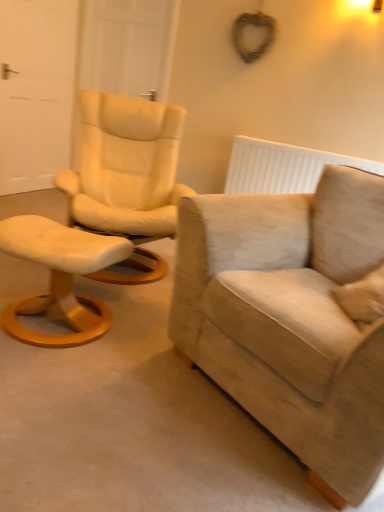
Question: Does beige fabric armchair at right contain white wood door at upper left, which appears as the 2th door when viewed from the left?

Choices:
 (A) no
 (B) yes

Answer: (A)

Question: Is the depth of beige fabric armchair at right greater than that of white wood door at upper left, which appears as the 2th door when viewed from the left?

Choices:
 (A) yes
 (B) no

Answer: (B)

Question: Could you tell me if beige fabric armchair at right is facing white wood door at upper left, which appears as the 2th door when viewed from the left?

Choices:
 (A) no
 (B) yes

Answer: (A)

Question: Is beige fabric armchair at right completely or partially outside of white wood door at upper left, which appears as the 2th door when viewed from the left?

Choices:
 (A) no
 (B) yes

Answer: (B)

Question: From the image's perspective, would you say beige fabric armchair at right is positioned over white wood door at upper left, which appears as the 2th door when viewed from the left?

Choices:
 (A) yes
 (B) no

Answer: (B)

Question: Is white fabric stool at left bigger or smaller than beige fabric armchair at right?

Choices:
 (A) big
 (B) small

Answer: (B)

Question: Is point (48, 221) positioned closer to the camera than point (319, 242)?

Choices:
 (A) closer
 (B) farther

Answer: (A)

Question: From the image's perspective, is white fabric stool at left positioned above or below beige fabric armchair at right?

Choices:
 (A) below
 (B) above

Answer: (B)

Question: From a real-world perspective, is white fabric stool at left physically located above or below beige fabric armchair at right?

Choices:
 (A) above
 (B) below

Answer: (B)

Question: Relative to white textured radiator at upper right, is white matte door at left, marked as the 2th door in a right-to-left arrangement, in front or behind?

Choices:
 (A) front
 (B) behind

Answer: (B)

Question: Considering the positions of white matte door at left, the first door in the left-to-right sequence, and white textured radiator at upper right in the image, is white matte door at left, the first door in the left-to-right sequence, bigger or smaller than white textured radiator at upper right?

Choices:
 (A) small
 (B) big

Answer: (B)

Question: Is white matte door at left, the first door in the left-to-right sequence, taller or shorter than white textured radiator at upper right?

Choices:
 (A) tall
 (B) short

Answer: (A)

Question: Does point (77, 8) appear closer or farther from the camera than point (336, 159)?

Choices:
 (A) closer
 (B) farther

Answer: (B)

Question: Is white fabric stool at left in front of or behind white textured radiator at upper right in the image?

Choices:
 (A) behind
 (B) front

Answer: (B)

Question: Considering the positions of white fabric stool at left and white textured radiator at upper right in the image, is white fabric stool at left bigger or smaller than white textured radiator at upper right?

Choices:
 (A) small
 (B) big

Answer: (B)